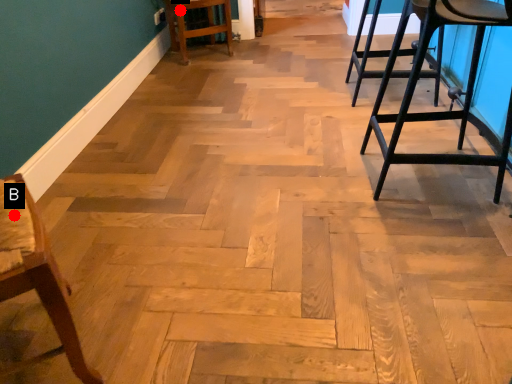
Question: Two points are circled on the image, labeled by A and B beside each circle. Among these points, which one is nearest to the camera?

Choices:
 (A) A is closer
 (B) B is closer

Answer: (B)